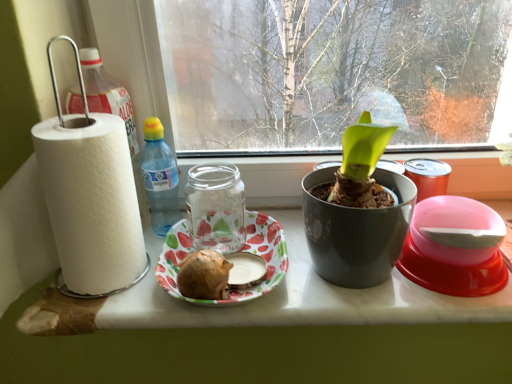
Where is `vacant area located to the right-hand side of brown matte potato at center`? This screenshot has width=512, height=384. vacant area located to the right-hand side of brown matte potato at center is located at coordinates (312, 294).